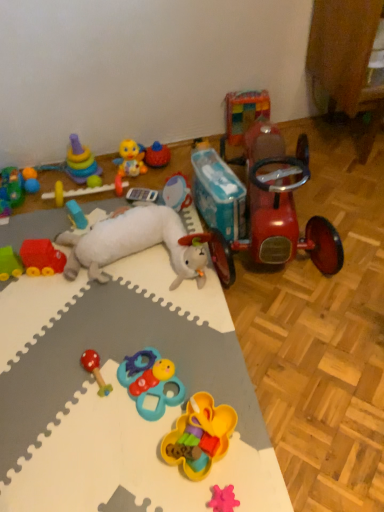
The height and width of the screenshot is (512, 384). Identify the location of free point to the right of translucent plastic toy at upper right, which is counted as the 2th toy, starting from the right. (298, 139).